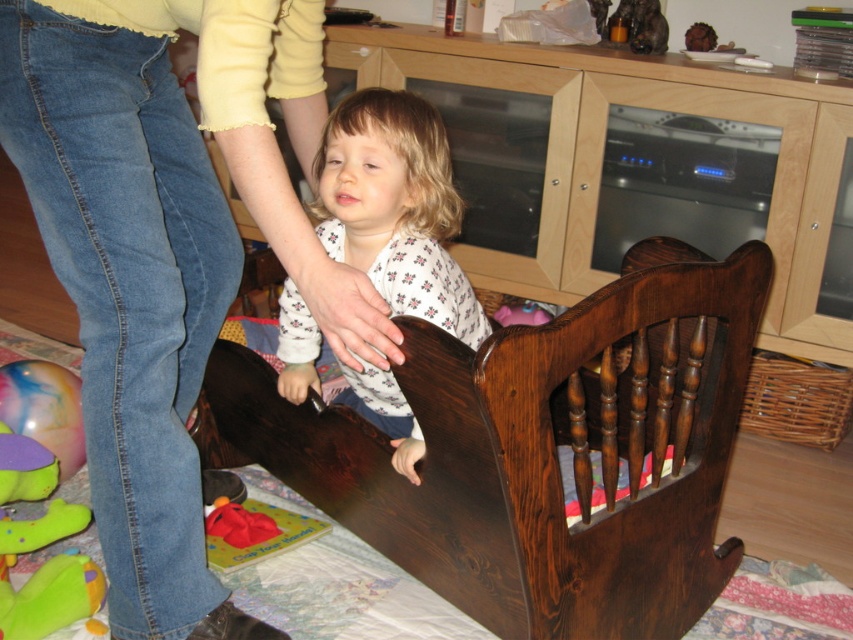
How much distance is there between denim jeans at lower left and soft plush toy at lower left?

They are 16.24 inches apart.

Can you confirm if denim jeans at lower left is smaller than soft plush toy at lower left?

No, denim jeans at lower left is not smaller than soft plush toy at lower left.

From the picture: Who is more distant from viewer, (161, 51) or (44, 570)?

Point (44, 570)

Identify the location of denim jeans at lower left. (167, 250).

Between denim jeans at lower left and dark brown wood infant bed at center, which one is positioned lower?

dark brown wood infant bed at center

Can you confirm if denim jeans at lower left is smaller than dark brown wood infant bed at center?

Correct, denim jeans at lower left occupies less space than dark brown wood infant bed at center.

Who is more forward, [123,161] or [628,550]?

Point [123,161] is in front.

Locate an element on the screen. denim jeans at lower left is located at coordinates (167, 250).

Based on the photo, does denim jeans at lower left lie behind white floral pajamas at center?

No, it is not.

Between denim jeans at lower left and white floral pajamas at center, which one has more height?

denim jeans at lower left

This screenshot has width=853, height=640. What do you see at coordinates (167, 250) in the screenshot? I see `denim jeans at lower left` at bounding box center [167, 250].

Locate an element on the screen. Image resolution: width=853 pixels, height=640 pixels. denim jeans at lower left is located at coordinates (167, 250).